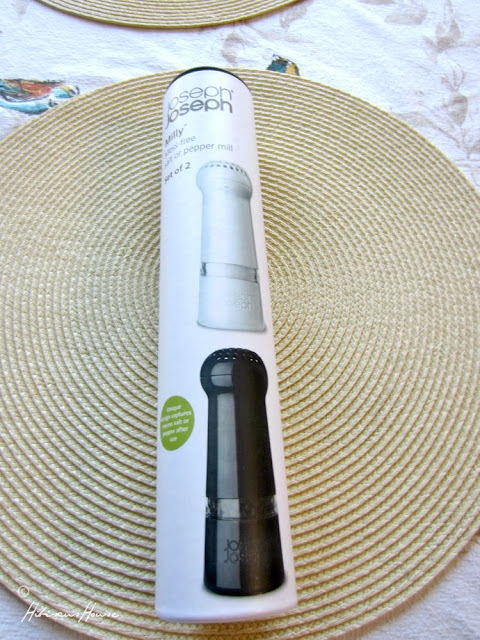
You are a GUI agent. You are given a task and a screenshot of the screen. Output one action in this format:
    pyautogui.click(x=<x>, y=<y>)
    Task: Click on the table cloth
    The image size is (480, 640).
    Given the screenshot: What is the action you would take?
    370,72